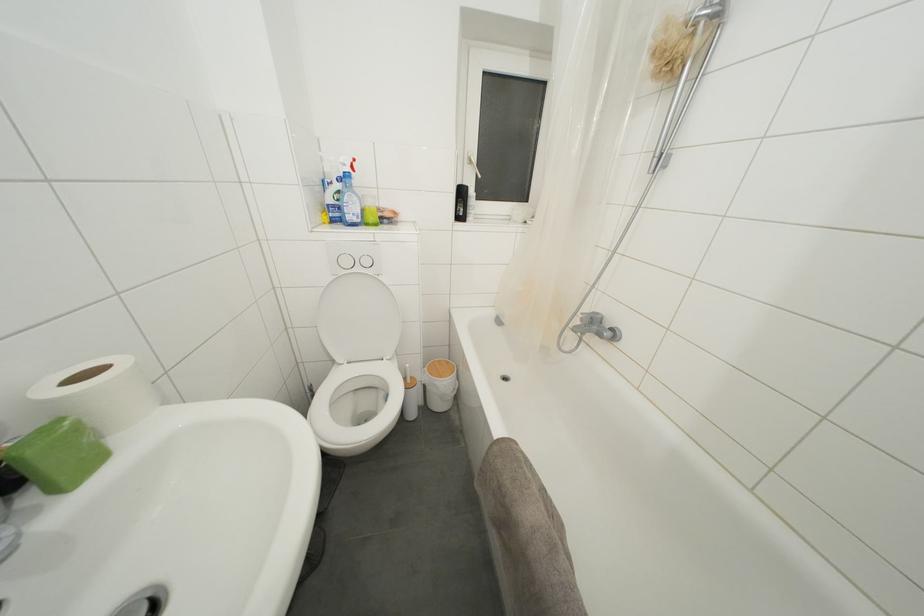
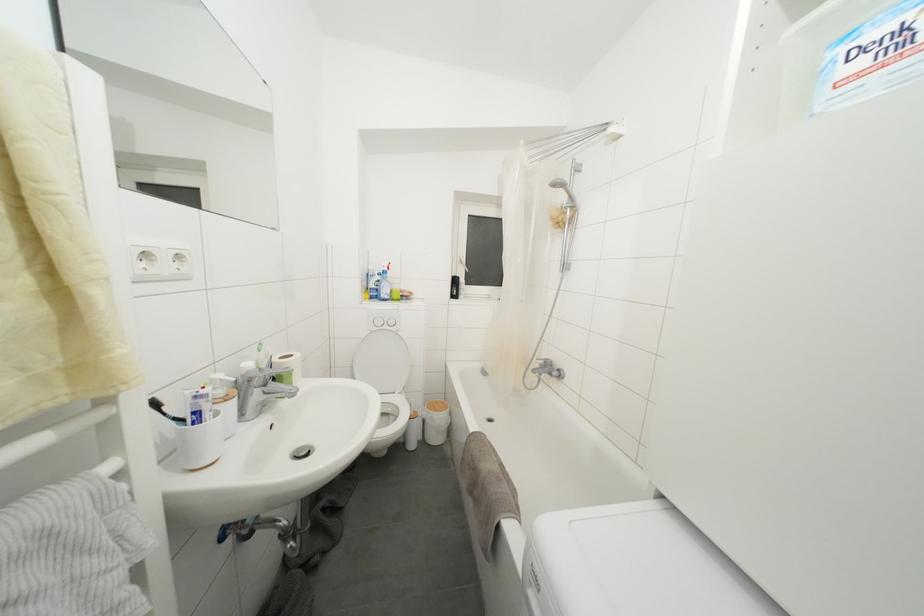
Where in the second image is the point corresponding to point 341,221 from the first image?

(379, 300)